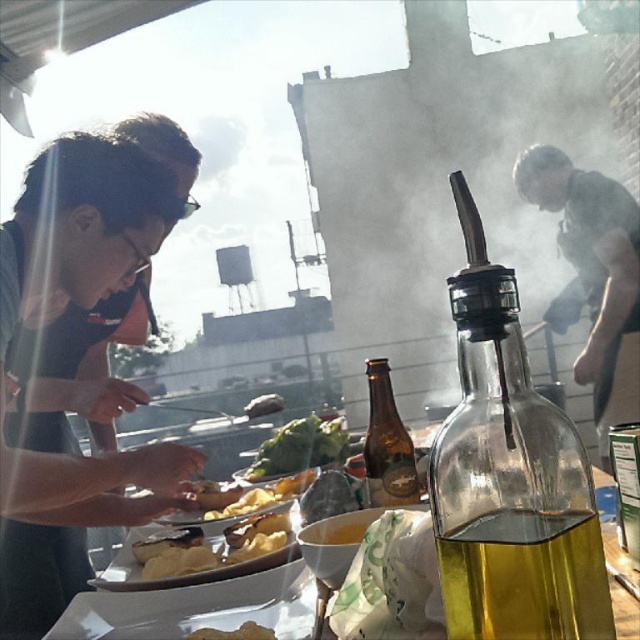
What is the spatial relationship between the green leafy vegetable at center and the other objects on the table?

The green leafy vegetable at center is located at point coordinates of (298, 448).

You are a chef standing at the table and want to place a new plate between the smoke at upper center and the brown glass bottle at center. Can you fit the plate there?

The smoke at upper center is taller than the brown glass bottle at center, so there is enough vertical space to place the plate between them.